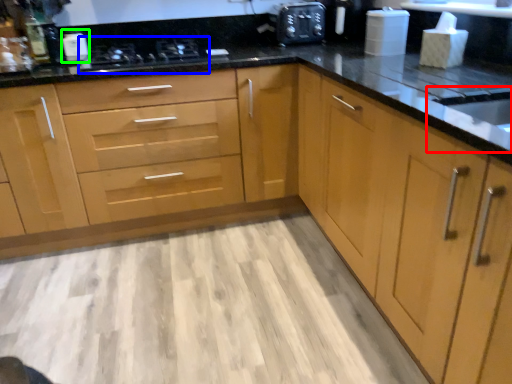
Question: Estimate the real-world distances between objects in this image. Which object is farther from sink (highlighted by a red box), stove (highlighted by a blue box) or appliance (highlighted by a green box)?

Choices:
 (A) stove
 (B) appliance

Answer: (B)